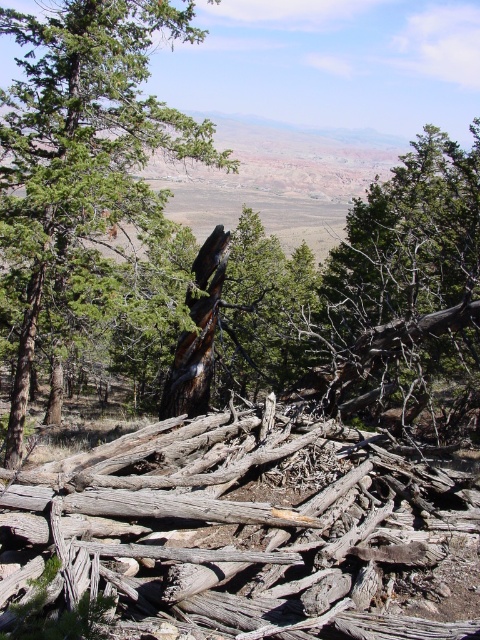
You are standing in the rugged landscape and want to reach the point at coordinates point (165,589) and point (64,161). Which point is closer to you?

Point (165,589) is closer to the camera than point (64,161), so you will reach point (165,589) first.

You are a hiker who has just arrived at the center of this rugged landscape. You notice two objects here. One is the weathered wood at center and the other is the brown rough tree trunk at center. Which one is positioned to the right of the other?

The weathered wood at center is to the right of the brown rough tree trunk at center.

You are standing in the middle of the rugged landscape described. There is a dark brown wood at center located at point (81, 154). If you want to reach this specific point, which direction should you move relative to your current position?

The dark brown wood at center is located at point (81, 154), so you should move towards that coordinate to reach it.